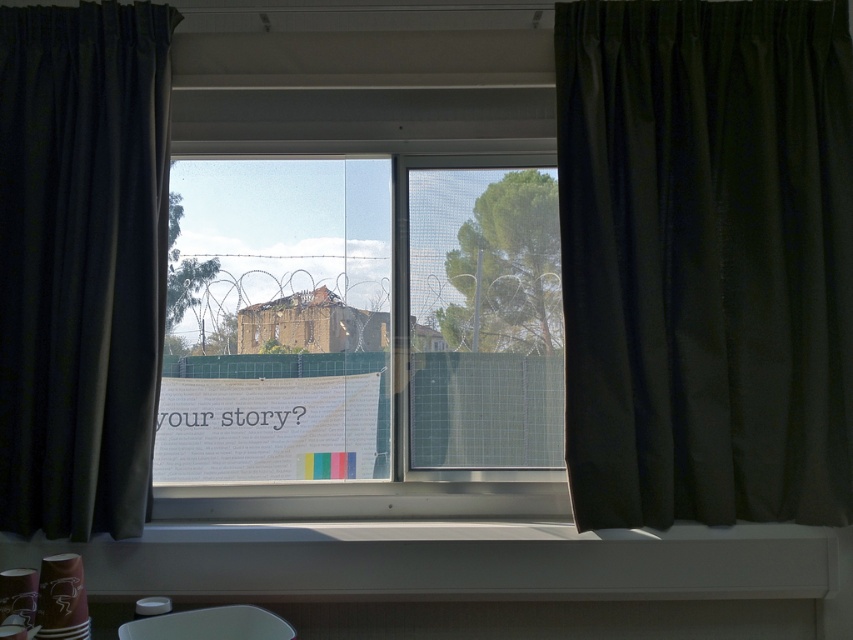
Question: Can you confirm if black silk curtain at right is smaller than black fabric curtain at left?

Choices:
 (A) no
 (B) yes

Answer: (A)

Question: Which of the following is the farthest from the observer?

Choices:
 (A) (149, 188)
 (B) (599, 214)
 (C) (142, 564)

Answer: (B)

Question: Which point is farther to the camera?

Choices:
 (A) black fabric curtain at left
 (B) transparent glass window at center
 (C) white plastic window sill at lower center

Answer: (B)

Question: Which object appears closest to the camera in this image?

Choices:
 (A) black silk curtain at right
 (B) transparent glass window at center

Answer: (A)

Question: Is black silk curtain at right below transparent glass window at center?

Choices:
 (A) no
 (B) yes

Answer: (A)

Question: Is transparent glass window at center closer to camera compared to black fabric curtain at left?

Choices:
 (A) no
 (B) yes

Answer: (A)